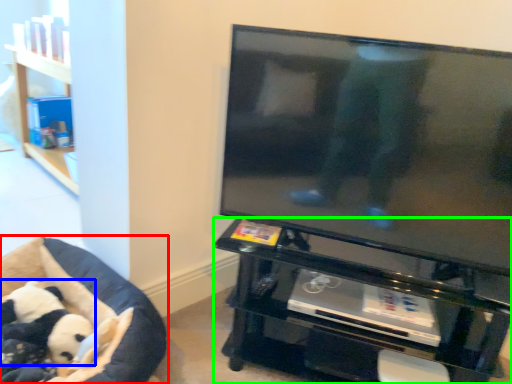
Question: Which object is the closest to the furniture (highlighted by a red box)? Choose among these: panda (highlighted by a blue box) or furniture (highlighted by a green box).

Choices:
 (A) panda
 (B) furniture

Answer: (A)